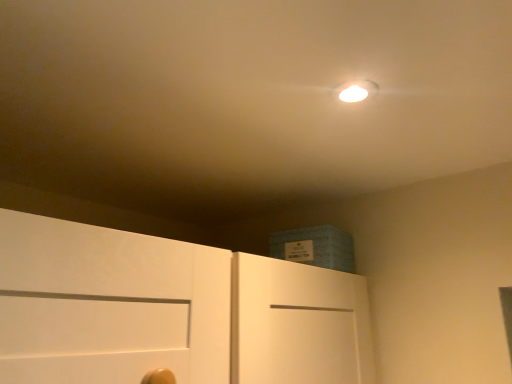
At what (x,y) coordinates should I click in order to perform the action: click on matte white light fixture at upper center. Please return your answer as a coordinate pair (x, y). Image resolution: width=512 pixels, height=384 pixels. Looking at the image, I should click on (355, 90).

What do you see at coordinates (355, 90) in the screenshot?
I see `matte white light fixture at upper center` at bounding box center [355, 90].

The height and width of the screenshot is (384, 512). Identify the location of matte white light fixture at upper center. (355, 90).